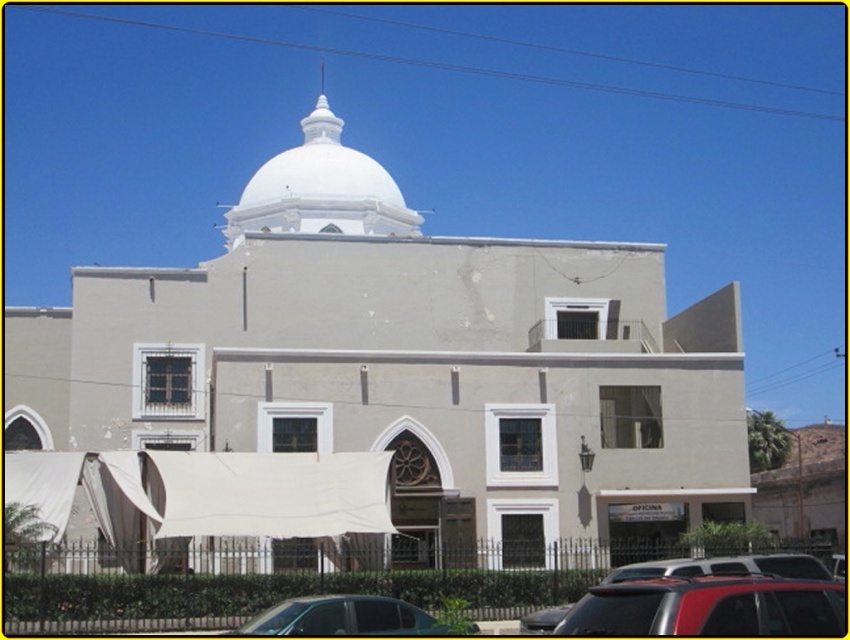
You are standing in front of the building and want to locate the point at coordinates point (404, 364). According to the scene description, where exactly is this point located?

The point (404, 364) is on the white concrete church at center.

You are a delivery driver arriving at the building. Your vehicle is the red matte suv at lower right. There is a parking space next to the white smooth dome at upper center. Can your suv fit into the parking space if the space is designed to accommodate the dome?

The red matte suv at lower right is narrower than the white smooth dome at upper center, so it should fit into the parking space designed for the dome.